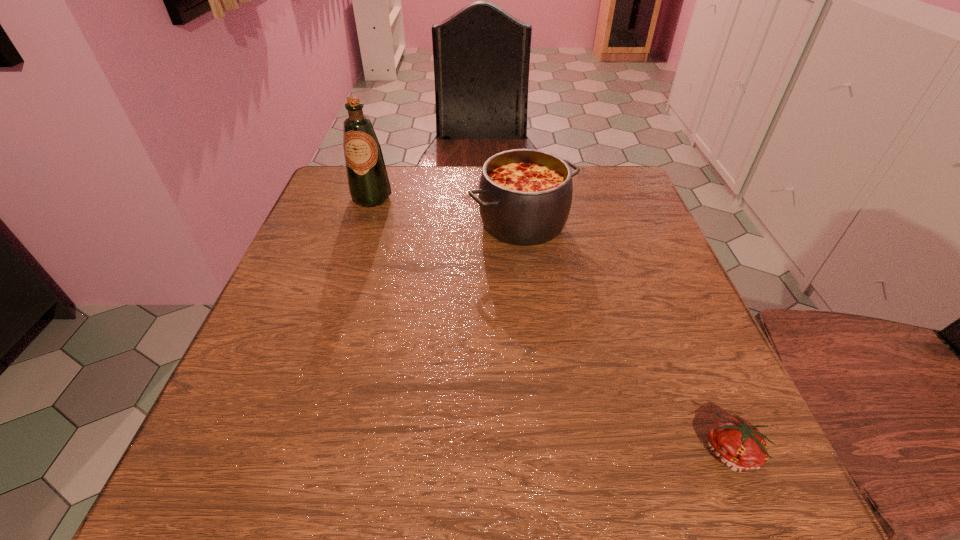
What are the coordinates of `vacant space that satisfies the following two spatial constraints: 1. on the front-facing side of the olive oil; 2. on the right side of the tomato` in the screenshot? It's located at (288, 452).

The height and width of the screenshot is (540, 960). In order to click on vacant position in the image that satisfies the following two spatial constraints: 1. on the front-facing side of the leftmost object; 2. on the right side of the second object from left to right in this screenshot , I will do `click(363, 223)`.

At what (x,y) coordinates should I click in order to perform the action: click on free space in the image that satisfies the following two spatial constraints: 1. on the front-facing side of the tallest object; 2. on the left side of the shortest object. Please return your answer as a coordinate pair (x, y). The image size is (960, 540). Looking at the image, I should click on (288, 452).

Find the location of a particular element. free space that satisfies the following two spatial constraints: 1. on the front-facing side of the leftmost object; 2. on the right side of the second object from left to right is located at coordinates (363, 223).